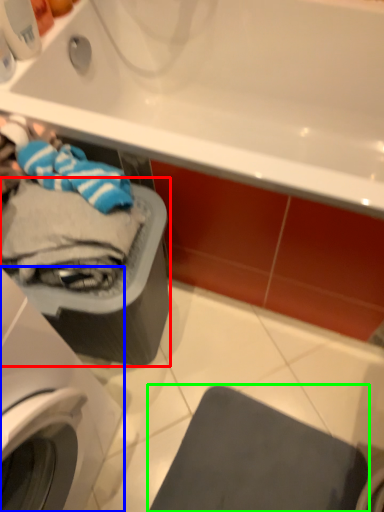
Question: Considering the real-world distances, which object is farthest from dish washer (highlighted by a red box)? washing machine (highlighted by a blue box) or gray (highlighted by a green box)?

Choices:
 (A) washing machine
 (B) gray

Answer: (B)